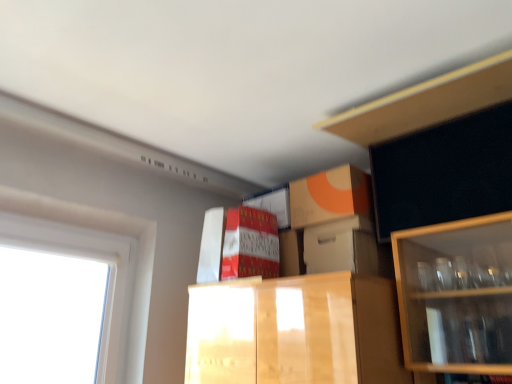
This screenshot has width=512, height=384. Describe the element at coordinates (96, 254) in the screenshot. I see `white plastic window at left` at that location.

The height and width of the screenshot is (384, 512). What do you see at coordinates (250, 244) in the screenshot? I see `matte cardboard box at center` at bounding box center [250, 244].

This screenshot has height=384, width=512. What do you see at coordinates (426, 103) in the screenshot? I see `wooden cabinet at upper right` at bounding box center [426, 103].

This screenshot has height=384, width=512. In order to click on white plastic window at left in this screenshot , I will do `click(96, 254)`.

Locate an element on the screen. The image size is (512, 384). cabinetry on the left of white cardboard box at center is located at coordinates (250, 244).

Does white cardboard box at center have a greater height compared to matte cardboard box at center?

In fact, white cardboard box at center may be shorter than matte cardboard box at center.

Which object is further away from the camera, white cardboard box at center or matte cardboard box at center?

matte cardboard box at center.

Is white cardboard box at center far away from matte cardboard box at center?

Actually, white cardboard box at center and matte cardboard box at center are a little close together.

From a real-world perspective, which object stands above the other?

wooden cabinet at upper right.

Based on the photo, does white plastic window at left come behind wooden cabinet at upper right?

Yes, the depth of white plastic window at left is greater than that of wooden cabinet at upper right.

Looking at this image, considering the sizes of white plastic window at left and wooden cabinet at upper right in the image, is white plastic window at left wider or thinner than wooden cabinet at upper right?

Considering their sizes, white plastic window at left looks slimmer than wooden cabinet at upper right.

Considering the relative sizes of white cardboard box at center and white plastic window at left in the image provided, is white cardboard box at center thinner than white plastic window at left?

Incorrect, the width of white cardboard box at center is not less than that of white plastic window at left.

Considering the sizes of objects white cardboard box at center and white plastic window at left in the image provided, who is smaller, white cardboard box at center or white plastic window at left?

Smaller between the two is white cardboard box at center.

How different are the orientations of white cardboard box at center and white plastic window at left in degrees?

white cardboard box at center and white plastic window at left are facing 90.8 degrees away from each other.

From the image's perspective, which is below, white plastic window at left or matte cardboard box at center?

white plastic window at left.

Is white plastic window at left smaller than matte cardboard box at center?

No.

Is white plastic window at left aimed at matte cardboard box at center?

Yes.

Considering the sizes of objects white plastic window at left and matte cardboard box at center in the image provided, who is taller, white plastic window at left or matte cardboard box at center?

white plastic window at left.

Can we say wooden cabinet at upper right lies outside matte cardboard box at center?

Yes, wooden cabinet at upper right is located beyond the bounds of matte cardboard box at center.

Considering the sizes of objects wooden cabinet at upper right and matte cardboard box at center in the image provided, who is taller, wooden cabinet at upper right or matte cardboard box at center?

Standing taller between the two is matte cardboard box at center.

From the image's perspective, which is above, wooden cabinet at upper right or matte cardboard box at center?

wooden cabinet at upper right.

Are wooden cabinet at upper right and white plastic window at left far apart?

Yes.

In the scene shown: Can you confirm if wooden cabinet at upper right is positioned to the right of white plastic window at left?

Indeed, wooden cabinet at upper right is positioned on the right side of white plastic window at left.

Is wooden cabinet at upper right aimed at white plastic window at left?

No, wooden cabinet at upper right does not turn towards white plastic window at left.

Can you confirm if wooden cabinet at upper right is wider than white plastic window at left?

Indeed, wooden cabinet at upper right has a greater width compared to white plastic window at left.

Is white plastic window at left completely or partially outside of white cardboard box at center?

Yes, white plastic window at left is outside of white cardboard box at center.

From the image's perspective, is white plastic window at left positioned above or below white cardboard box at center?

Based on their image positions, white plastic window at left is located beneath white cardboard box at center.

Is white plastic window at left wider or thinner than white cardboard box at center?

white plastic window at left is thinner than white cardboard box at center.

Is the position of white plastic window at left less distant than that of white cardboard box at center?

Yes, it is in front of white cardboard box at center.

The image size is (512, 384). I want to click on storage box below the matte cardboard box at center (from the image's perspective), so click(x=341, y=247).

Identify the location of window to the left of wooden cabinet at upper right. This screenshot has width=512, height=384. (96, 254).

Looking at the image, which one is located further to white cardboard box at center, white plastic window at left or matte cardboard box at center?

Among the two, white plastic window at left is located further to white cardboard box at center.

Looking at the image, which one is located closer to wooden cabinet at upper right, white cardboard box at center or matte cardboard box at center?

white cardboard box at center lies closer to wooden cabinet at upper right than the other object.

Looking at the image, which one is located further to matte cardboard box at center, white plastic window at left or white cardboard box at center?

Based on the image, white plastic window at left appears to be further to matte cardboard box at center.

Based on their spatial positions, is wooden cabinet at upper right or white plastic window at left further from white cardboard box at center?

white plastic window at left lies further to white cardboard box at center than the other object.

When comparing their distances from white cardboard box at center, does matte cardboard box at center or white plastic window at left seem closer?

The object closer to white cardboard box at center is matte cardboard box at center.

Which object lies further to the anchor point wooden cabinet at upper right, matte cardboard box at center or white plastic window at left?

Among the two, white plastic window at left is located further to wooden cabinet at upper right.

Looking at the image, which one is located further to wooden cabinet at upper right, matte cardboard box at center or white cardboard box at center?

The object further to wooden cabinet at upper right is matte cardboard box at center.

From the image, which object appears to be farther from white cardboard box at center, matte cardboard box at center or wooden cabinet at upper right?

wooden cabinet at upper right is further to white cardboard box at center.

The height and width of the screenshot is (384, 512). I want to click on cabinetry between white plastic window at left and wooden cabinet at upper right in the horizontal direction, so click(x=250, y=244).

At what (x,y) coordinates should I click in order to perform the action: click on storage box located between white plastic window at left and wooden cabinet at upper right in the left-right direction. Please return your answer as a coordinate pair (x, y). Looking at the image, I should click on pyautogui.click(x=341, y=247).

Find the location of a particular element. This screenshot has width=512, height=384. storage box between matte cardboard box at center and wooden cabinet at upper right from left to right is located at coordinates (341, 247).

Identify the location of cabinetry located between white plastic window at left and white cardboard box at center in the left-right direction. The image size is (512, 384). (250, 244).